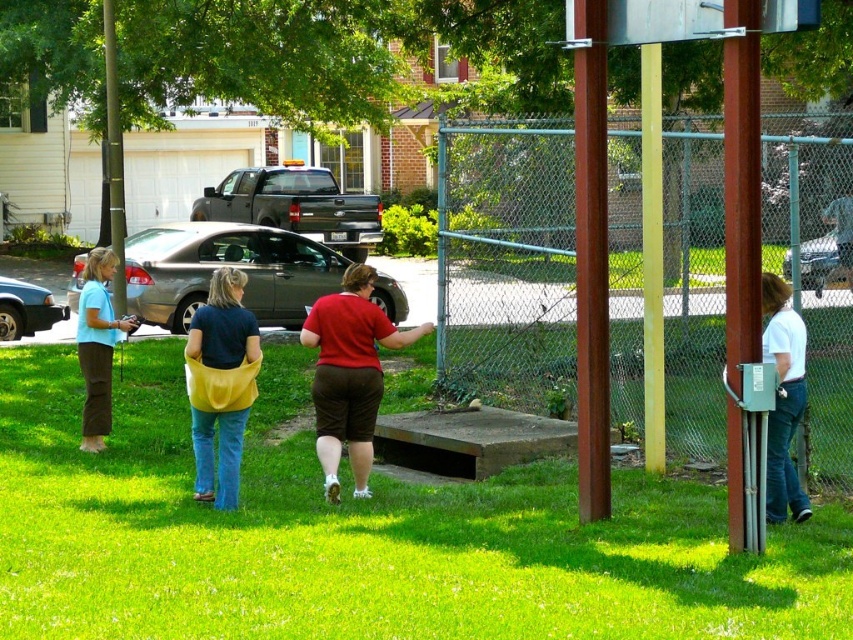
Which is more to the right, metallic silver basketball hoop at right or white cotton shirt at right?

white cotton shirt at right is more to the right.

Where is `metallic silver basketball hoop at right`? metallic silver basketball hoop at right is located at coordinates (605, 182).

This screenshot has width=853, height=640. Identify the location of metallic silver basketball hoop at right. (605, 182).

Who is taller, red matte shorts at center or white cotton shirt at right?

Standing taller between the two is red matte shorts at center.

Is the position of red matte shorts at center more distant than that of white cotton shirt at right?

Yes, it is.

Where is `red matte shorts at center`? This screenshot has width=853, height=640. red matte shorts at center is located at coordinates (349, 372).

Does blue denim jeans at center appear on the right side of white cotton shirt at right?

Incorrect, blue denim jeans at center is not on the right side of white cotton shirt at right.

Is point (231, 417) positioned before point (769, 330)?

No.

At what (x,y) coordinates should I click in order to perform the action: click on blue denim jeans at center. Please return your answer as a coordinate pair (x, y). The width and height of the screenshot is (853, 640). Looking at the image, I should click on (221, 384).

At what (x,y) coordinates should I click in order to perform the action: click on blue denim jeans at center. Please return your answer as a coordinate pair (x, y). The image size is (853, 640). Looking at the image, I should click on (221, 384).